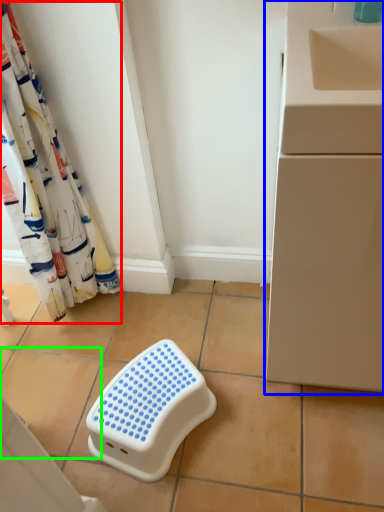
Question: Which object is positioned farthest from curtain (highlighted by a red box)? Select from counter (highlighted by a blue box) and ceramic tile (highlighted by a green box).

Choices:
 (A) counter
 (B) ceramic tile

Answer: (A)